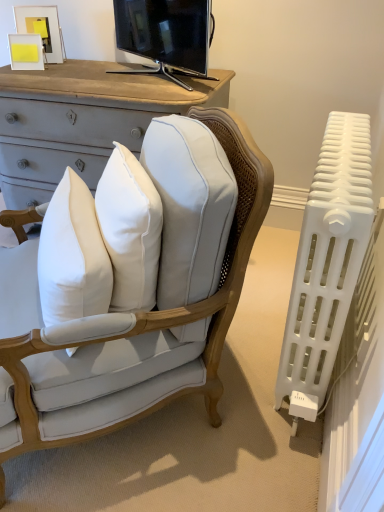
Question: Is black glossy tv at upper center at the right side of white plastic radiator at right?

Choices:
 (A) no
 (B) yes

Answer: (A)

Question: Is black glossy tv at upper center not inside white plastic radiator at right?

Choices:
 (A) no
 (B) yes

Answer: (B)

Question: Can you see black glossy tv at upper center touching white plastic radiator at right?

Choices:
 (A) no
 (B) yes

Answer: (A)

Question: From the image's perspective, would you say black glossy tv at upper center is positioned over white plastic radiator at right?

Choices:
 (A) no
 (B) yes

Answer: (B)

Question: Could you tell me if black glossy tv at upper center is facing white plastic radiator at right?

Choices:
 (A) yes
 (B) no

Answer: (B)

Question: From a real-world perspective, is black glossy tv at upper center located higher than white plastic radiator at right?

Choices:
 (A) no
 (B) yes

Answer: (B)

Question: Can you confirm if matte white picture frame at upper left, the second picture frame positioned from the bottom, is thinner than white cotton pillow at center?

Choices:
 (A) no
 (B) yes

Answer: (B)

Question: Is matte white picture frame at upper left, the second picture frame positioned from the bottom, touching white cotton pillow at center?

Choices:
 (A) yes
 (B) no

Answer: (B)

Question: Considering the relative sizes of matte white picture frame at upper left, the 1th picture frame positioned from the top, and white cotton pillow at center in the image provided, is matte white picture frame at upper left, the 1th picture frame positioned from the top, taller than white cotton pillow at center?

Choices:
 (A) yes
 (B) no

Answer: (B)

Question: Does matte white picture frame at upper left, the 1th picture frame positioned from the top, have a lesser height compared to white cotton pillow at center?

Choices:
 (A) no
 (B) yes

Answer: (B)

Question: Could white cotton pillow at center be considered to be inside matte white picture frame at upper left, the second picture frame positioned from the bottom?

Choices:
 (A) no
 (B) yes

Answer: (A)

Question: From the image's perspective, is matte white picture frame at upper left, the second picture frame positioned from the bottom, located above white cotton pillow at center?

Choices:
 (A) yes
 (B) no

Answer: (A)

Question: From a real-world perspective, is matte white picture frame at upper left, the second picture frame positioned from the bottom, under white plastic radiator at right?

Choices:
 (A) no
 (B) yes

Answer: (A)